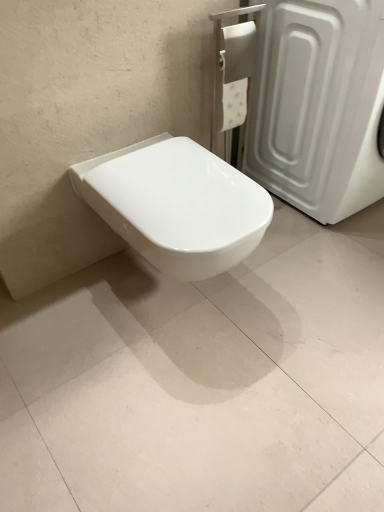
Question: Considering the positions of white glossy toilet at center and white glossy toilet at center in the image, is white glossy toilet at center wider or thinner than white glossy toilet at center?

Choices:
 (A) wide
 (B) thin

Answer: (A)

Question: In terms of height, does white glossy toilet at center look taller or shorter compared to white glossy toilet at center?

Choices:
 (A) tall
 (B) short

Answer: (B)

Question: Estimate the real-world distances between objects in this image. Which object is farther from the white plastic screen door at upper right?

Choices:
 (A) white glossy toilet at center
 (B) white glossy toilet at center

Answer: (B)

Question: Which object is positioned closest to the white glossy toilet at center?

Choices:
 (A) white plastic screen door at upper right
 (B) white glossy toilet at center

Answer: (B)